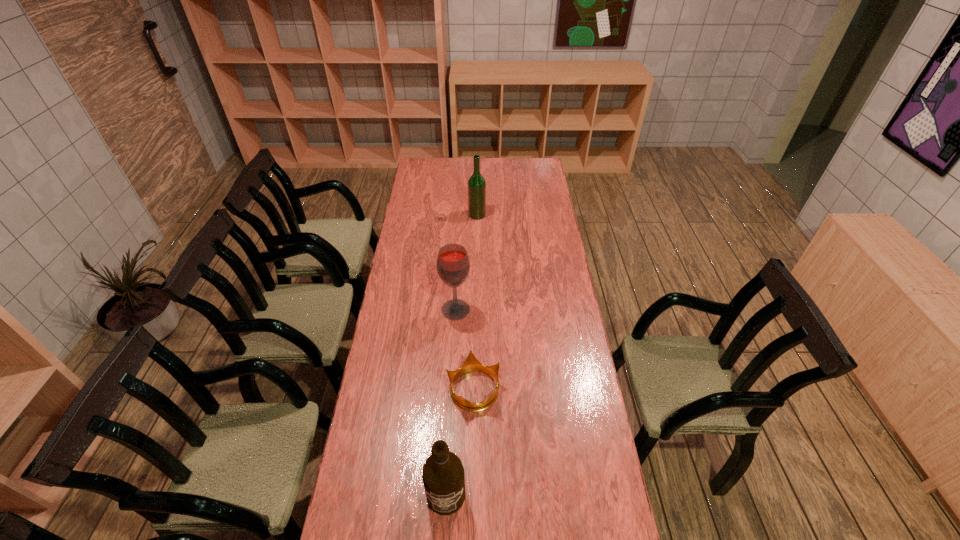
The height and width of the screenshot is (540, 960). Identify the location of the farthest object. (476, 184).

You are a GUI agent. You are given a task and a screenshot of the screen. Output one action in this format:
    pyautogui.click(x=<x>, y=<y>)
    Task: Click on the second farthest object
    The image size is (960, 540).
    Given the screenshot: What is the action you would take?
    point(453,265)

Image resolution: width=960 pixels, height=540 pixels. Find the location of `the nearest alcohol`. the nearest alcohol is located at coordinates (443, 477).

Identify the location of the second nearest object. (471, 363).

Where is `crown`? crown is located at coordinates (471, 363).

The image size is (960, 540). I want to click on free region located on the front of the farthest object, so click(x=477, y=250).

Locate an element on the screen. The image size is (960, 540). vacant space situated on the front of the third nearest object is located at coordinates (453, 358).

At what (x,y) coordinates should I click in order to perform the action: click on free space located on the label of the nearest object. Please return your answer as a coordinate pair (x, y). Looking at the image, I should click on (444, 535).

You are a GUI agent. You are given a task and a screenshot of the screen. Output one action in this format:
    pyautogui.click(x=<x>, y=<y>)
    Task: Click on the vacant space positioned 0.310m on the right of the crown
    
    Given the screenshot: What is the action you would take?
    pyautogui.click(x=588, y=389)

This screenshot has width=960, height=540. In the image, there is a desktop. What are the coordinates of `vacant area at the far edge` in the screenshot? It's located at (483, 159).